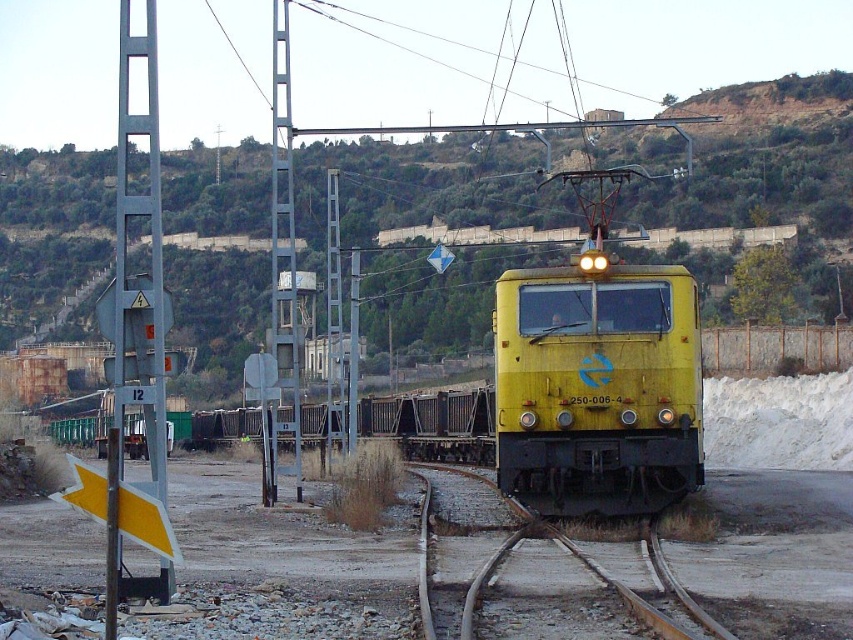
You are a train conductor observing the scene. The green grassy hillside at upper center and the yellow matte train at center are both visible. Which object occupies more space in the image?

The green grassy hillside at upper center occupies more space in the image compared to the yellow matte train at center, as it has a larger size.

You are standing at the point closer to you between the two points, point (x=720, y=96) and point (x=498, y=467). Which point are you standing at?

You are standing at point (x=720, y=96) because it is closer to the viewer than point (x=498, y=467).

You are a photographer trying to capture the yellow matte train at center and the green grassy hillside at upper center in a single frame. Based on their widths, which object would occupy more horizontal space in the photo?

The green grassy hillside at upper center has a greater width than the yellow matte train at center, so it would occupy more horizontal space in the photo.